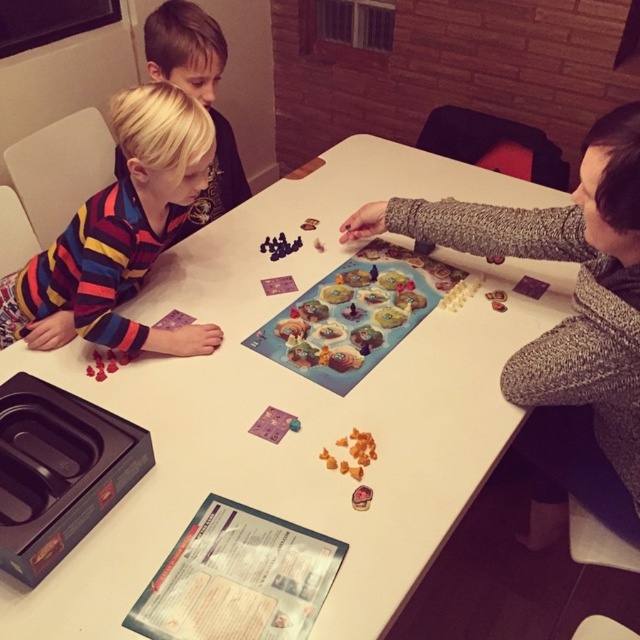
Looking at this image, you are a delivery robot standing 1.5 meters away from the table. You need to place a new game piece at point (468,168) on the table. Can you reach that point without moving closer than your current distance?

The distance of point (468,168) from the camera is 2.02 meters. Since the robot is currently 1.5 meters away from the table, it can reach the point as it is within its operational range without needing to move closer.

Where is the matte gray sweater at upper right located in the image?

The matte gray sweater at upper right is located at point (563, 324) in the image.

You are a guest at this board game gathering and want to place a small notebook on the table without moving any game pieces. Considering the space occupied by the matte gray sweater at upper right and the wooden board game at center, which object should you avoid placing the notebook near to ensure there is enough space?

You should avoid placing the notebook near the matte gray sweater at upper right because its width is larger than the wooden board game at center, meaning it occupies more space on the table.